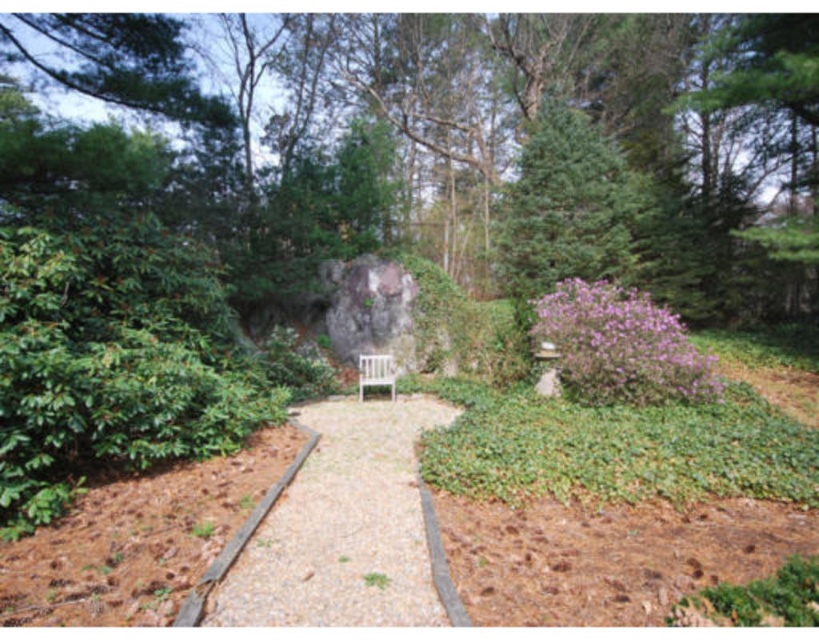
Is green leafy tree at center thinner than gravel path at center?

Incorrect, green leafy tree at center's width is not less than gravel path at center's.

Does green leafy tree at center have a smaller size compared to gravel path at center?

Actually, green leafy tree at center might be larger than gravel path at center.

Where is `green leafy tree at center`? green leafy tree at center is located at coordinates (444, 144).

Image resolution: width=819 pixels, height=640 pixels. I want to click on green leafy tree at center, so pos(444,144).

Who is taller, green leafy tree at center or white wooden bench at center?

green leafy tree at center

Is point (80, 51) less distant than point (365, 371)?

Yes, point (80, 51) is closer to viewer.

Which is behind, point (71, 65) or point (383, 369)?

The point (383, 369) is more distant.

This screenshot has width=819, height=640. What are the coordinates of `green leafy tree at center` in the screenshot? It's located at (444, 144).

Is point (331, 554) positioned behind point (390, 368)?

That is False.

Which is more to the right, gravel path at center or white wooden bench at center?

From the viewer's perspective, gravel path at center appears more on the right side.

This screenshot has width=819, height=640. What are the coordinates of `gravel path at center` in the screenshot? It's located at (347, 529).

Find the location of a particular element. The height and width of the screenshot is (640, 819). gravel path at center is located at coordinates (347, 529).